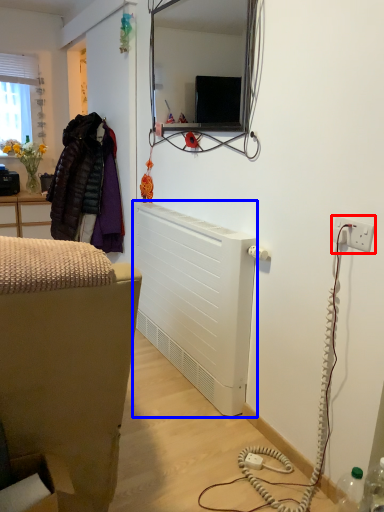
Question: Which of the following is the farthest to the observer, electric outlet (highlighted by a red box) or radiator (highlighted by a blue box)?

Choices:
 (A) electric outlet
 (B) radiator

Answer: (B)